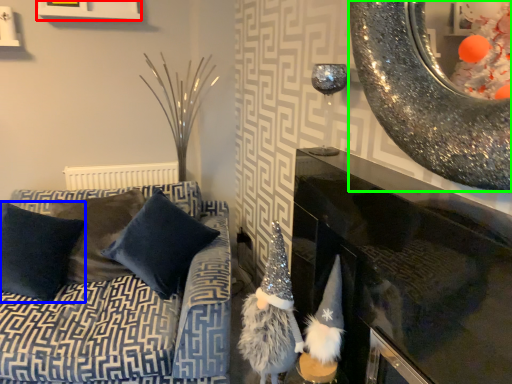
Question: Estimate the real-world distances between objects in this image. Which object is farther from picture frame (highlighted by a red box), pillow (highlighted by a blue box) or oval (highlighted by a green box)?

Choices:
 (A) pillow
 (B) oval

Answer: (B)